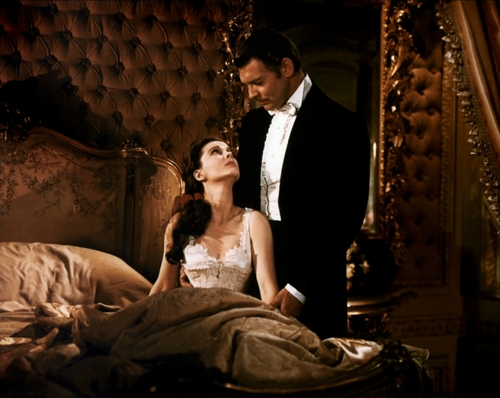
I want to click on pillow, so click(47, 262).